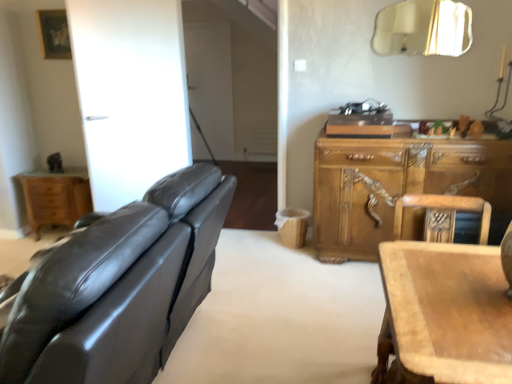
Question: Does light brown wood nightstand at left contain wooden carved cabinet at right?

Choices:
 (A) no
 (B) yes

Answer: (A)

Question: Is light brown wood nightstand at left far from wooden carved cabinet at right?

Choices:
 (A) yes
 (B) no

Answer: (A)

Question: Considering the relative sizes of light brown wood nightstand at left and wooden carved cabinet at right in the image provided, is light brown wood nightstand at left thinner than wooden carved cabinet at right?

Choices:
 (A) yes
 (B) no

Answer: (A)

Question: Does light brown wood nightstand at left come in front of wooden carved cabinet at right?

Choices:
 (A) no
 (B) yes

Answer: (A)

Question: Could you tell me if light brown wood nightstand at left is facing wooden carved cabinet at right?

Choices:
 (A) no
 (B) yes

Answer: (A)

Question: From the image's perspective, is light brown wood nightstand at left on top of wooden carved cabinet at right?

Choices:
 (A) yes
 (B) no

Answer: (B)

Question: Considering the relative sizes of wooden carved cabinet at right and wooden chair at right in the image provided, is wooden carved cabinet at right thinner than wooden chair at right?

Choices:
 (A) no
 (B) yes

Answer: (A)

Question: Does wooden carved cabinet at right have a larger size compared to wooden chair at right?

Choices:
 (A) no
 (B) yes

Answer: (B)

Question: Is wooden carved cabinet at right aimed at wooden chair at right?

Choices:
 (A) no
 (B) yes

Answer: (B)

Question: Is wooden carved cabinet at right far away from wooden chair at right?

Choices:
 (A) no
 (B) yes

Answer: (A)

Question: Is wooden carved cabinet at right positioned with its back to wooden chair at right?

Choices:
 (A) no
 (B) yes

Answer: (A)

Question: From the image's perspective, does wooden carved cabinet at right appear lower than wooden chair at right?

Choices:
 (A) no
 (B) yes

Answer: (A)

Question: Considering the relative sizes of matte black leather couch at left and gold metallic mirror at upper right in the image provided, is matte black leather couch at left taller than gold metallic mirror at upper right?

Choices:
 (A) no
 (B) yes

Answer: (B)